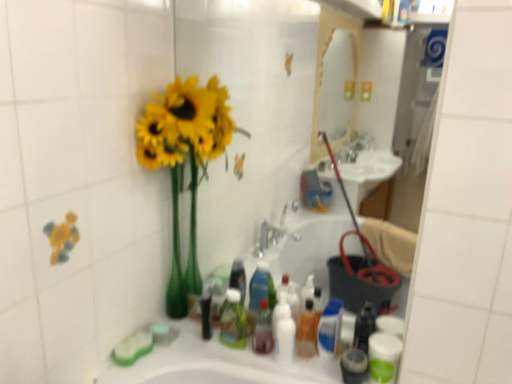
Question: Can you confirm if translucent plastic mouthwash at center, placed as the 4th mouthwash when sorted from right to left, is positioned to the left of white glossy bottle at center, the 2th toiletry from the left?

Choices:
 (A) yes
 (B) no

Answer: (A)

Question: Is white glossy bottle at center, the 2th toiletry from the left, a part of translucent plastic mouthwash at center, which ranks as the 1th mouthwash in left-to-right order?

Choices:
 (A) yes
 (B) no

Answer: (B)

Question: Considering the relative sizes of translucent plastic mouthwash at center, placed as the 4th mouthwash when sorted from right to left, and white glossy bottle at center, the 2th toiletry from the left, in the image provided, is translucent plastic mouthwash at center, placed as the 4th mouthwash when sorted from right to left, thinner than white glossy bottle at center, the 2th toiletry from the left,?

Choices:
 (A) yes
 (B) no

Answer: (B)

Question: Is translucent plastic mouthwash at center, placed as the 4th mouthwash when sorted from right to left, closer to the viewer compared to white glossy bottle at center, the 2th toiletry from the left?

Choices:
 (A) yes
 (B) no

Answer: (B)

Question: Is translucent plastic mouthwash at center, placed as the 4th mouthwash when sorted from right to left, facing away from white glossy bottle at center, the 2th toiletry from the left?

Choices:
 (A) yes
 (B) no

Answer: (B)

Question: Is translucent plastic mouthwash at center, which ranks as the 1th mouthwash in left-to-right order, outside white glossy bottle at center, arranged as the 2th toiletry when viewed from the right?

Choices:
 (A) no
 (B) yes

Answer: (B)

Question: Is translucent plastic mouthwash at lower right, the 2th mouthwash viewed from the right, at the left side of white glossy mouthwash at lower right, which is the 4th mouthwash in left-to-right order?

Choices:
 (A) yes
 (B) no

Answer: (A)

Question: Is translucent plastic mouthwash at lower right, the 2th mouthwash viewed from the right, wider than white glossy mouthwash at lower right, marked as the first mouthwash in a right-to-left arrangement?

Choices:
 (A) no
 (B) yes

Answer: (A)

Question: Are translucent plastic mouthwash at lower right, the 3th mouthwash viewed from the left, and white glossy mouthwash at lower right, marked as the first mouthwash in a right-to-left arrangement, far apart?

Choices:
 (A) yes
 (B) no

Answer: (B)

Question: Considering the relative positions of translucent plastic mouthwash at lower right, the 2th mouthwash viewed from the right, and white glossy mouthwash at lower right, which is the 4th mouthwash in left-to-right order, in the image provided, is translucent plastic mouthwash at lower right, the 2th mouthwash viewed from the right, to the right of white glossy mouthwash at lower right, which is the 4th mouthwash in left-to-right order, from the viewer's perspective?

Choices:
 (A) no
 (B) yes

Answer: (A)

Question: Can you confirm if translucent plastic mouthwash at lower right, the 2th mouthwash viewed from the right, is thinner than white glossy mouthwash at lower right, which is the 4th mouthwash in left-to-right order?

Choices:
 (A) yes
 (B) no

Answer: (A)

Question: Would you say translucent plastic mouthwash at lower right, the 3th mouthwash viewed from the left, is outside white glossy mouthwash at lower right, marked as the first mouthwash in a right-to-left arrangement?

Choices:
 (A) no
 (B) yes

Answer: (B)

Question: From a real-world perspective, is yellow matte vase at left beneath white glossy bottle at center, arranged as the 2th toiletry when viewed from the right?

Choices:
 (A) yes
 (B) no

Answer: (B)